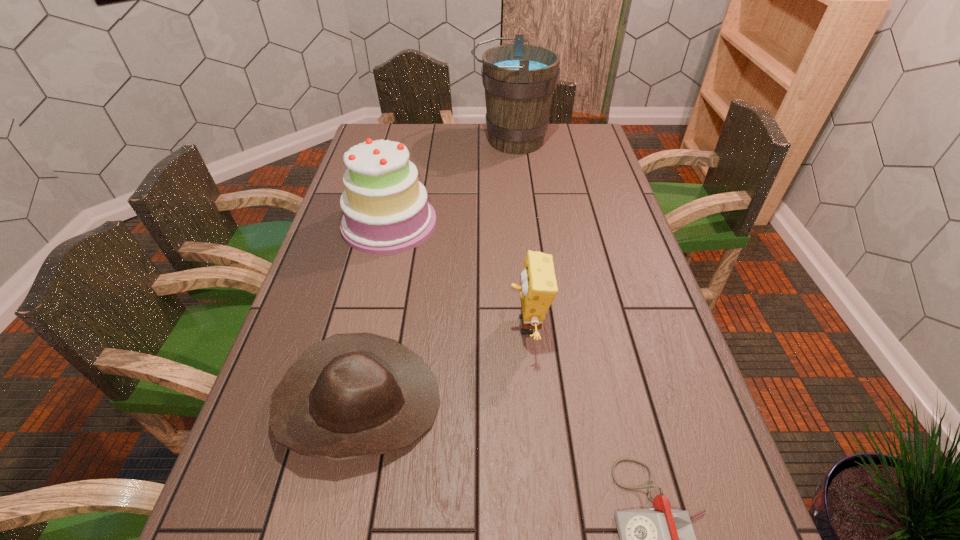
Image resolution: width=960 pixels, height=540 pixels. I want to click on unoccupied area between the second shortest object and the sponge, so (x=443, y=364).

At what (x,y) coordinates should I click in order to perform the action: click on free space between the third tallest object and the fourth shortest object. Please return your answer as a coordinate pair (x, y). The width and height of the screenshot is (960, 540). Looking at the image, I should click on (459, 274).

I want to click on vacant space in between the cowboy hat and the wine bucket, so click(435, 272).

Locate an element on the screen. The width and height of the screenshot is (960, 540). free space that is in between the cowboy hat and the sponge is located at coordinates click(443, 364).

Locate an element on the screen. The width and height of the screenshot is (960, 540). free spot between the second farthest object and the farthest object is located at coordinates (450, 182).

Image resolution: width=960 pixels, height=540 pixels. I want to click on vacant space that's between the second tallest object and the farthest object, so click(x=450, y=182).

Choose which object is the fourth nearest neighbor to the second shortest object. Please provide its 2D coordinates. Your answer should be formatted as a tuple, i.e. [(x, y)], where the tuple contains the x and y coordinates of a point satisfying the conditions above.

[(519, 79)]

Identify which object is the nearest to the tallest object. Please provide its 2D coordinates. Your answer should be formatted as a tuple, i.e. [(x, y)], where the tuple contains the x and y coordinates of a point satisfying the conditions above.

[(386, 211)]

Where is `free space in the image that satisfies the following two spatial constraints: 1. on the front side of the cake; 2. on the right side of the fourth tallest object`? The height and width of the screenshot is (540, 960). free space in the image that satisfies the following two spatial constraints: 1. on the front side of the cake; 2. on the right side of the fourth tallest object is located at coordinates (348, 403).